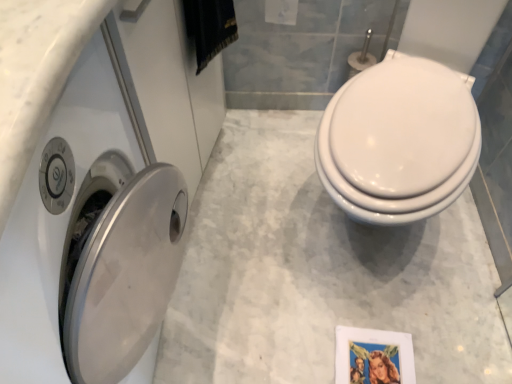
Question: Is satin silver washer at left in front of or behind white glossy toilet paper at upper center in the image?

Choices:
 (A) behind
 (B) front

Answer: (B)

Question: Do you think satin silver washer at left is within white glossy toilet paper at upper center, or outside of it?

Choices:
 (A) outside
 (B) inside

Answer: (A)

Question: Which object is positioned farthest from the metallic silver picture frame at lower right?

Choices:
 (A) white glossy toilet at right
 (B) white glossy toilet paper at upper center
 (C) satin silver washer at left

Answer: (B)

Question: Estimate the real-world distances between objects in this image. Which object is farther from the satin silver washer at left?

Choices:
 (A) white glossy toilet at right
 (B) metallic silver picture frame at lower right
 (C) white glossy toilet paper at upper center

Answer: (C)